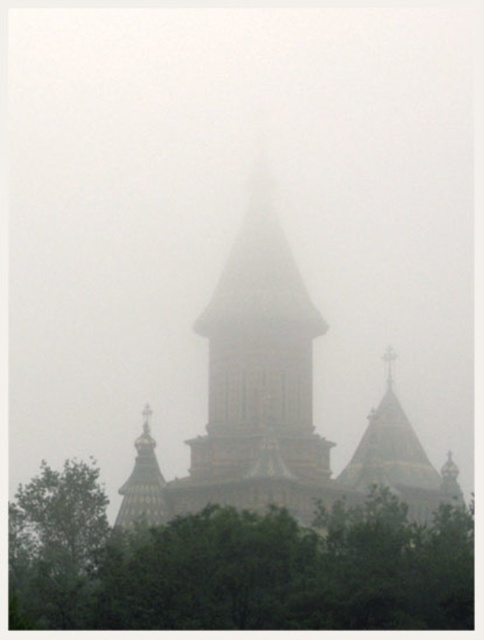
Can you confirm if green leafy tree at lower center is bigger than green leafy tree at left?

Yes, green leafy tree at lower center is bigger than green leafy tree at left.

Is green leafy tree at lower center taller than green leafy tree at left?

Incorrect, green leafy tree at lower center's height is not larger of green leafy tree at left's.

Is point (96, 593) positioned in front of point (66, 538)?

Yes.

You are a GUI agent. You are given a task and a screenshot of the screen. Output one action in this format:
    pyautogui.click(x=<x>, y=<y>)
    Task: Click on the green leafy tree at lower center
    This screenshot has height=640, width=484.
    Given the screenshot: What is the action you would take?
    pyautogui.click(x=232, y=564)

Can you confirm if green leafy tree at lower center is positioned to the right of golden mosaic temple at center?

No, green leafy tree at lower center is not to the right of golden mosaic temple at center.

Between green leafy tree at lower center and golden mosaic temple at center, which one has more height?

golden mosaic temple at center

Who is more distant from viewer, (423, 595) or (151, 448)?

Positioned behind is point (151, 448).

Image resolution: width=484 pixels, height=640 pixels. In order to click on green leafy tree at lower center in this screenshot , I will do `click(232, 564)`.

From the picture: Does golden mosaic temple at center have a larger size compared to green leafy tree at left?

Yes.

Where is `golden mosaic temple at center`? golden mosaic temple at center is located at coordinates (275, 404).

The height and width of the screenshot is (640, 484). I want to click on golden mosaic temple at center, so click(275, 404).

Where is `golden mosaic temple at center`? The height and width of the screenshot is (640, 484). golden mosaic temple at center is located at coordinates (275, 404).